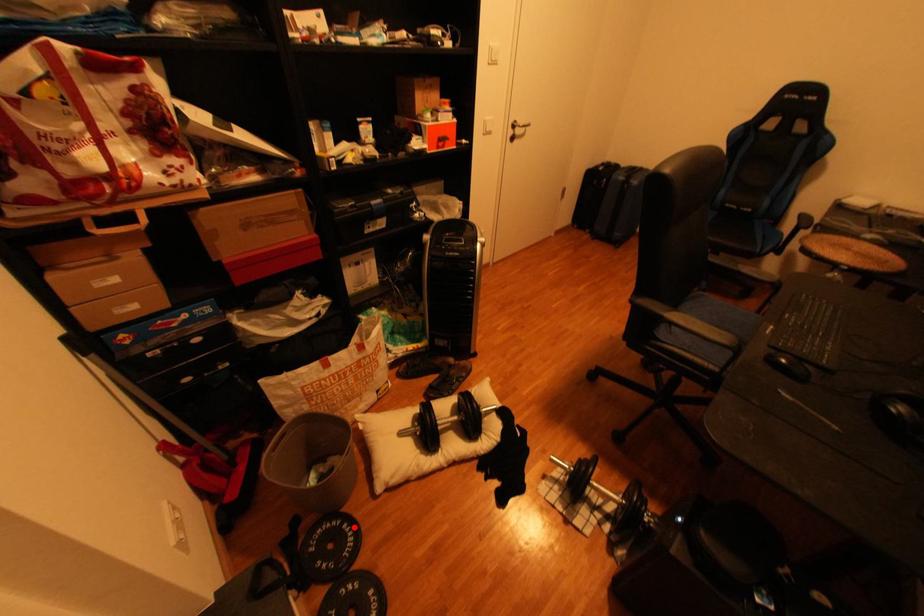
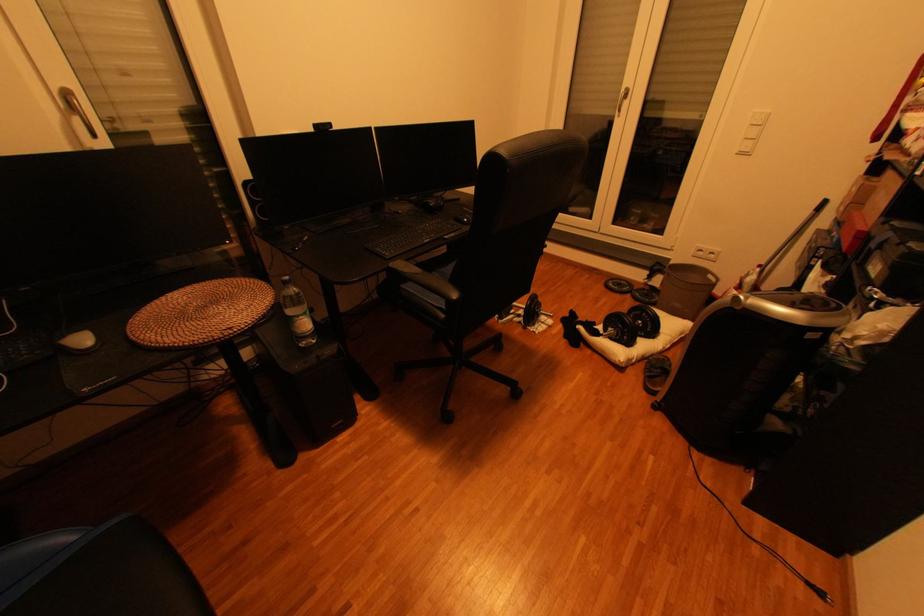
Locate, in the second image, the point that corresponds to the highlighted location in the first image.

(658, 301)